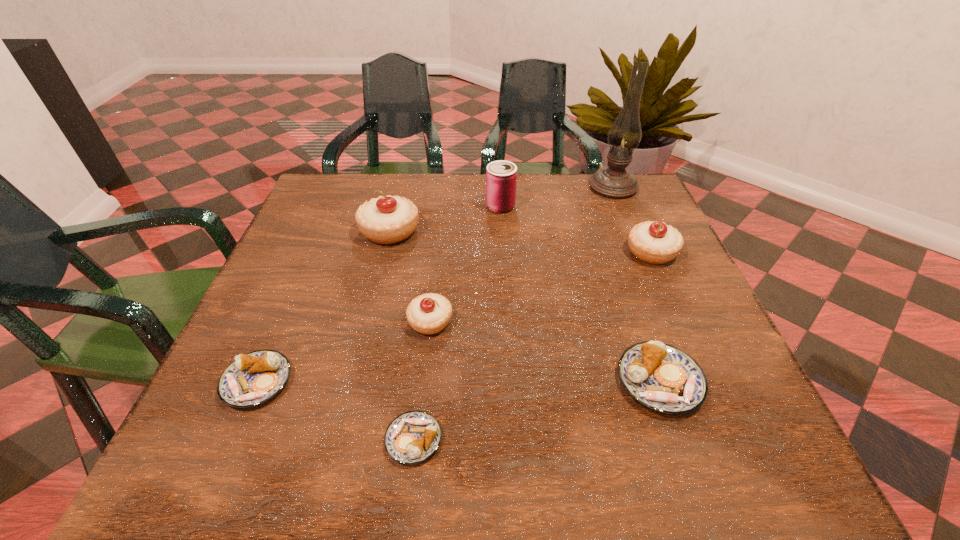
I want to click on the second closest beige pastry to the third shortest object, so click(x=428, y=314).

Identify which brown pastry is located as the second nearest to the second shortest object. Please provide its 2D coordinates. Your answer should be formatted as a tuple, i.e. [(x, y)], where the tuple contains the x and y coordinates of a point satisfying the conditions above.

[(663, 378)]

At what (x,y) coordinates should I click in order to perform the action: click on the second closest brown pastry to the rightmost brown pastry. Please return your answer as a coordinate pair (x, y). The image size is (960, 540). Looking at the image, I should click on (252, 379).

I want to click on free location that satisfies the following two spatial constraints: 1. on the front side of the fourth object from right to left; 2. on the right side of the rightmost brown pastry, so click(511, 381).

Locate an element on the screen. This screenshot has width=960, height=540. blank space that satisfies the following two spatial constraints: 1. on the back side of the fifth shortest object; 2. on the left side of the second brown pastry from left to right is located at coordinates (435, 252).